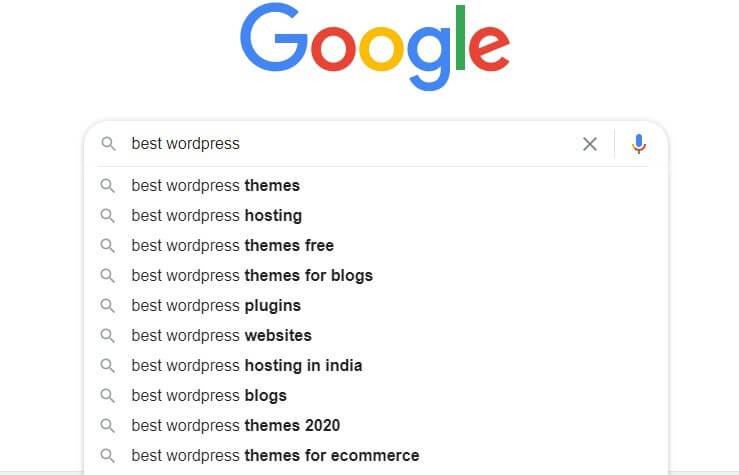
Where is `exit button`? The width and height of the screenshot is (739, 475). exit button is located at coordinates (585, 141).